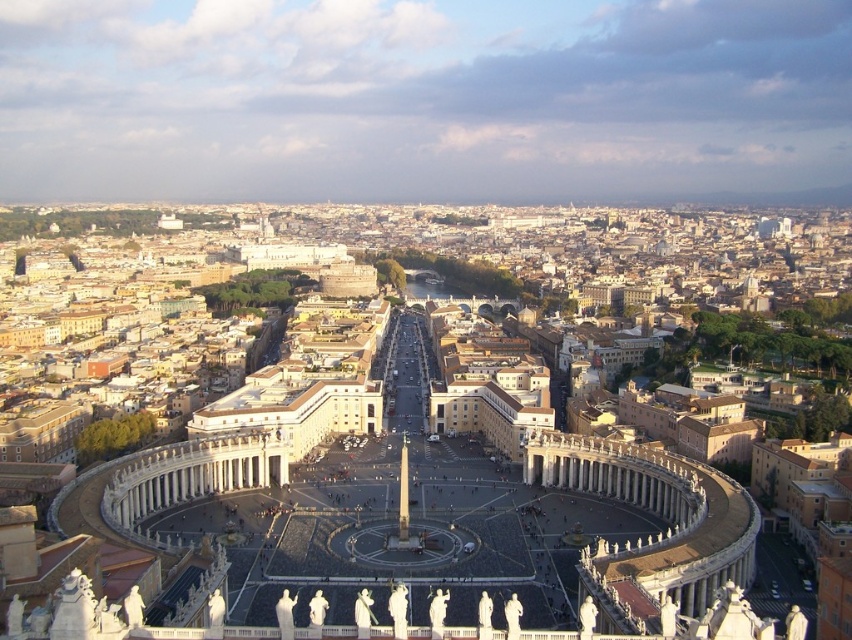
You are an architect visiting St. Peter Square. You notice the white marble palace at center and the white marble pillar at center. Which one has a greater width?

The white marble palace at center has a greater width than the white marble pillar at center.

You are a tourist standing at the edge of St. Peter Square and want to take a photo of the white marble palace at center. Based on your current position, which direction should you face to capture the palace in your frame?

The white marble palace at center is positioned at point (x=459, y=477), which means it is located towards the right side of the square. Therefore, you should face towards the right to capture the palace in your frame.

You are a tourist standing at the edge of St. Peter Square, looking towards the center. You see the white marble palace at center and the white marble pillar at center. Which one appears taller to you?

The white marble palace at center appears much taller than the white marble pillar at center.